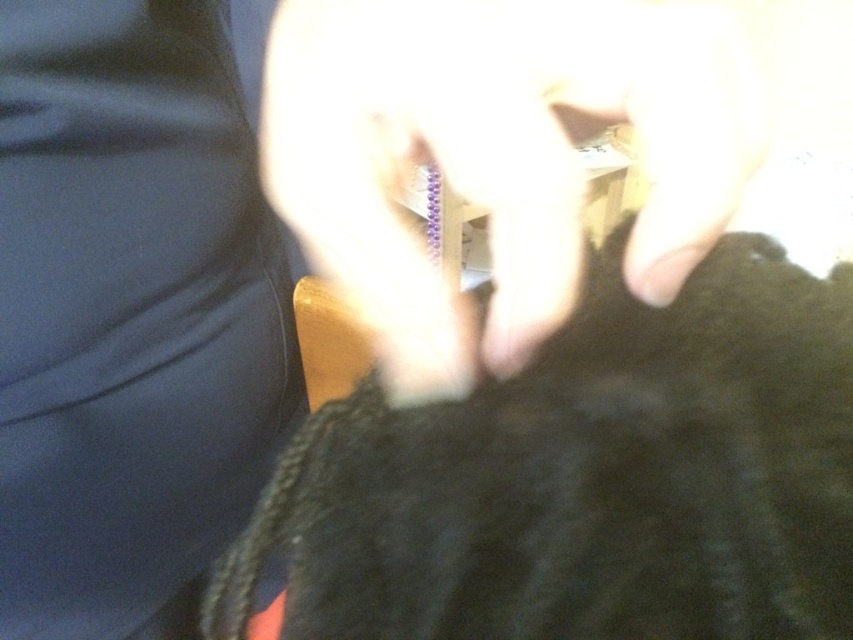
Who is more distant from viewer, (x=694, y=490) or (x=541, y=296)?

Positioned behind is point (x=541, y=296).

Does point (694, 417) come behind point (426, 288)?

No, (694, 417) is in front of (426, 288).

The width and height of the screenshot is (853, 640). I want to click on black fuzzy fur at center, so click(x=587, y=480).